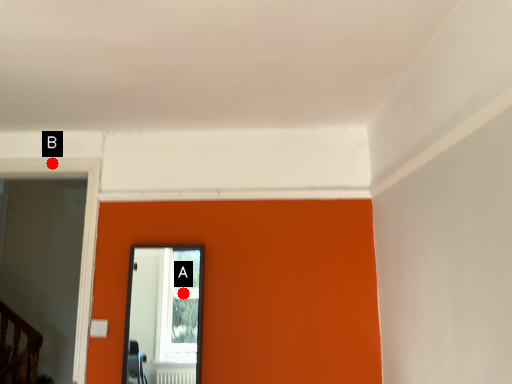
Question: Two points are circled on the image, labeled by A and B beside each circle. Which of the following is the closest to the observer?

Choices:
 (A) A is closer
 (B) B is closer

Answer: (B)